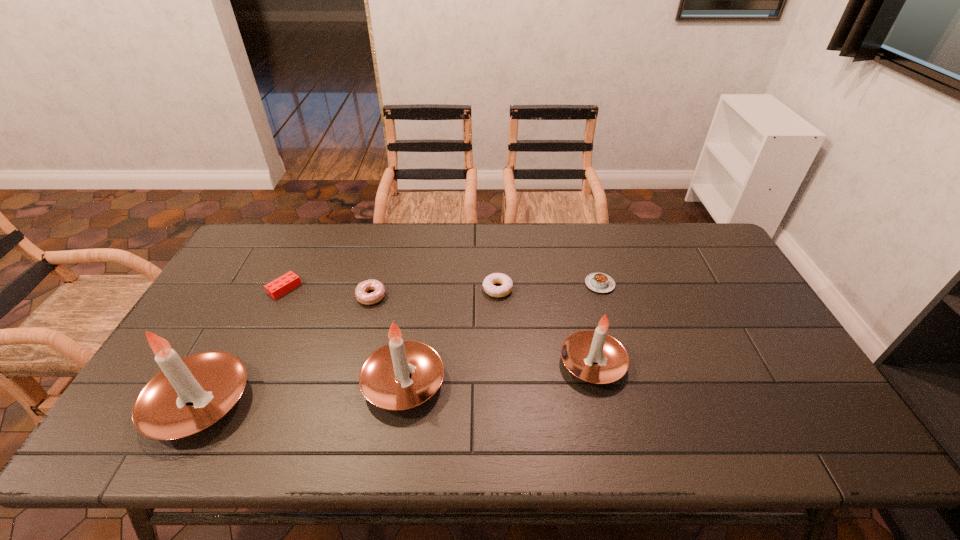
The width and height of the screenshot is (960, 540). What are the coordinates of `vacant area that lies between the left doughnut and the second shortest candle` in the screenshot? It's located at (388, 339).

Locate an element on the screen. free space that is in between the right doughnut and the shortest candle is located at coordinates (545, 326).

Image resolution: width=960 pixels, height=540 pixels. Identify the location of the sixth closest object to the third tallest object. (280, 286).

Locate an element on the screen. The height and width of the screenshot is (540, 960). the second closest object to the sixth shortest object is located at coordinates (496, 278).

At what (x,y) coordinates should I click in order to perform the action: click on candle that is the third nearest to the left doughnut. Please return your answer as a coordinate pair (x, y). This screenshot has height=540, width=960. Looking at the image, I should click on [594, 356].

Choose which candle is the third nearest neighbor to the pudding. Please provide its 2D coordinates. Your answer should be formatted as a tuple, i.e. [(x, y)], where the tuple contains the x and y coordinates of a point satisfying the conditions above.

[(189, 394)]

Identify the location of vacant space that satisfies the following two spatial constraints: 1. on the back side of the leftmost candle; 2. on the left side of the left doughnut. (256, 296).

The image size is (960, 540). I want to click on vacant space that satisfies the following two spatial constraints: 1. on the back side of the shortest candle; 2. on the right side of the pudding, so click(x=574, y=284).

This screenshot has width=960, height=540. I want to click on free space in the image that satisfies the following two spatial constraints: 1. on the back side of the second shortest candle; 2. on the right side of the pudding, so click(419, 284).

Where is `vacant area that satisfies the following two spatial constraints: 1. on the back side of the pudding; 2. on the left side of the leftmost candle`? vacant area that satisfies the following two spatial constraints: 1. on the back side of the pudding; 2. on the left side of the leftmost candle is located at coordinates (263, 284).